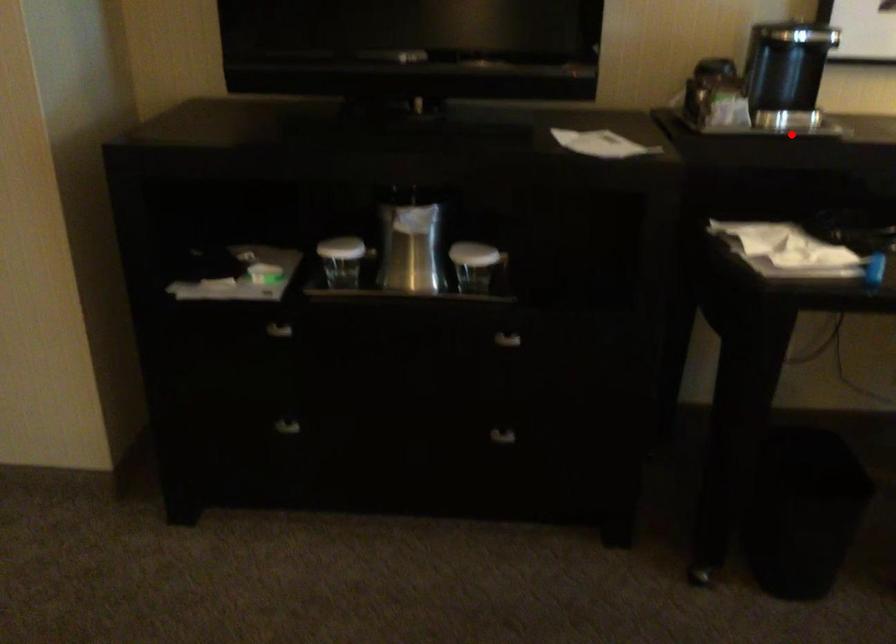
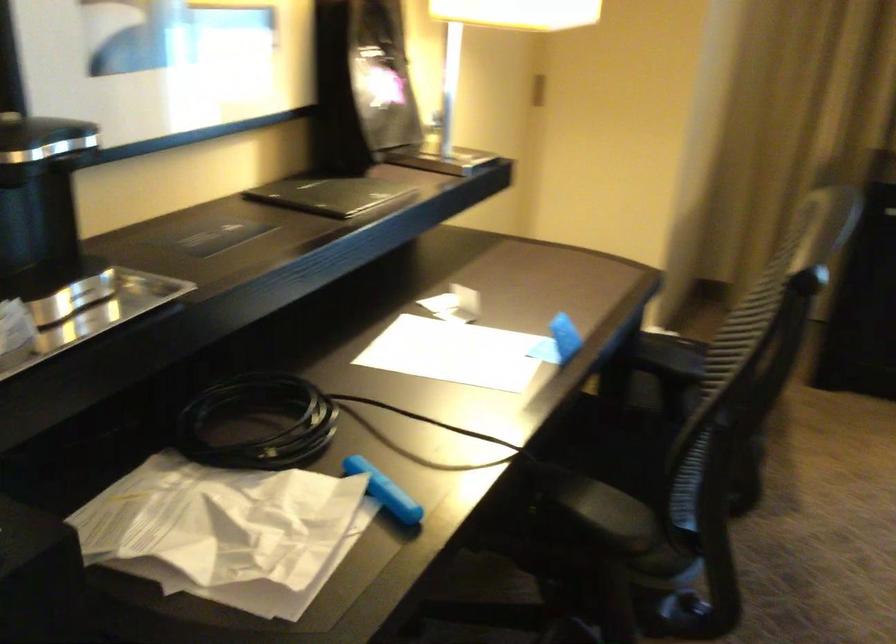
The point at the highlighted location is marked in the first image. Where is the corresponding point in the second image?

(90, 310)